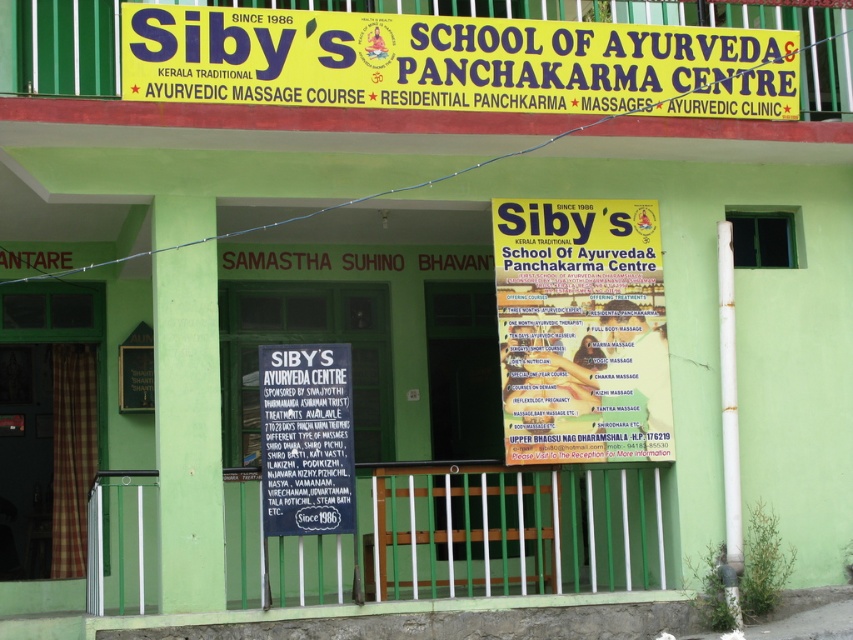
Question: Which point is farther from the camera taking this photo?

Choices:
 (A) (281, 461)
 (B) (151, 401)

Answer: (B)

Question: Is yellow/yellowish paper sign at upper center smaller than yellow paper flyer at center?

Choices:
 (A) yes
 (B) no

Answer: (B)

Question: Can you confirm if yellow paper flyer at center is wider than matte black signboard at center?

Choices:
 (A) no
 (B) yes

Answer: (B)

Question: Which of the following is the farthest from the observer?

Choices:
 (A) (746, 99)
 (B) (517, 224)

Answer: (A)

Question: Which of the following is the closest to the observer?

Choices:
 (A) matte black signboard at center
 (B) black paper sign at center
 (C) yellow/yellowish paper sign at upper center

Answer: (C)

Question: Observing the image, what is the correct spatial positioning of yellow/yellowish paper sign at upper center in reference to yellow paper flyer at center?

Choices:
 (A) below
 (B) above

Answer: (B)